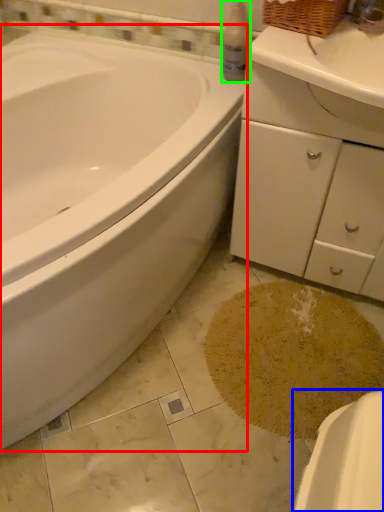
Question: Based on their relative distances, which object is nearer to bathtub (highlighted by a red box)? Choose from porcelain (highlighted by a blue box) and cleaning product (highlighted by a green box).

Choices:
 (A) porcelain
 (B) cleaning product

Answer: (B)